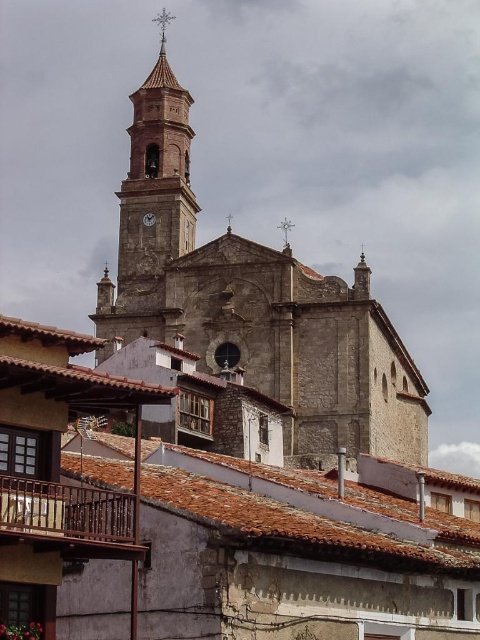
Between stone church at center and metallic clock at center, which one has more height?

stone church at center is taller.

The height and width of the screenshot is (640, 480). Identify the location of stone church at center. (253, 301).

Between point (211, 332) and point (287, 221), which one is positioned behind?

The point (287, 221) is more distant.

Can you confirm if stone church at center is positioned below silver metallic spire at upper center?

Actually, stone church at center is above silver metallic spire at upper center.

Which is behind, point (354, 365) or point (284, 230)?

The point (284, 230) is behind.

The width and height of the screenshot is (480, 640). I want to click on stone church at center, so click(253, 301).

Which is below, silver metallic spire at upper center or metallic clock at center?

Positioned lower is metallic clock at center.

From the picture: Does silver metallic spire at upper center have a lesser height compared to metallic clock at center?

No.

Who is more distant from viewer, [287,221] or [148,212]?

The point [287,221] is more distant.

Locate an element on the screen. This screenshot has height=640, width=480. silver metallic spire at upper center is located at coordinates (286, 230).